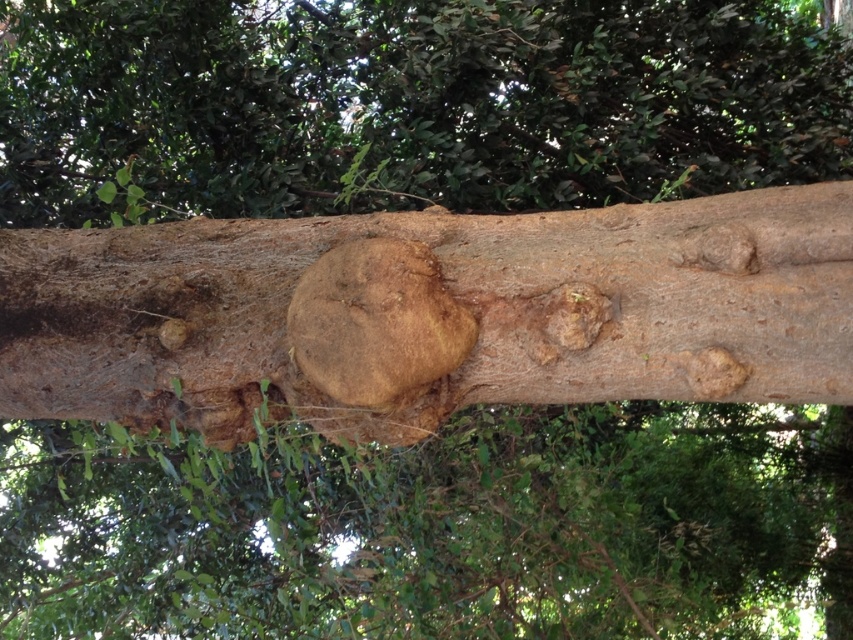
Looking at this image, you are a botanist examining the tree trunk. You notice the smooth brown bark at center and the brown rough tree knot at center. Which of these two features has a greater width?

The smooth brown bark at center has a greater width than the brown rough tree knot at center according to the description.

You are a botanist examining the tree trunk. You notice two features at the center of the trunk. One is the smooth brown bark at center and the other is the brown rough tree knot at center. Which one has a larger surface area?

The smooth brown bark at center is bigger than the brown rough tree knot at center, so the smooth brown bark at center has a larger surface area.

You are a botanist examining a tree trunk with several growths. You notice a point marked at coordinates (430, 314). Based on the scene, what is the condition of the bark at that point?

The point marked at coordinates (430, 314) is smooth brown bark at center, indicating it is likely healthy compared to the surrounding rough textured bark with growths.